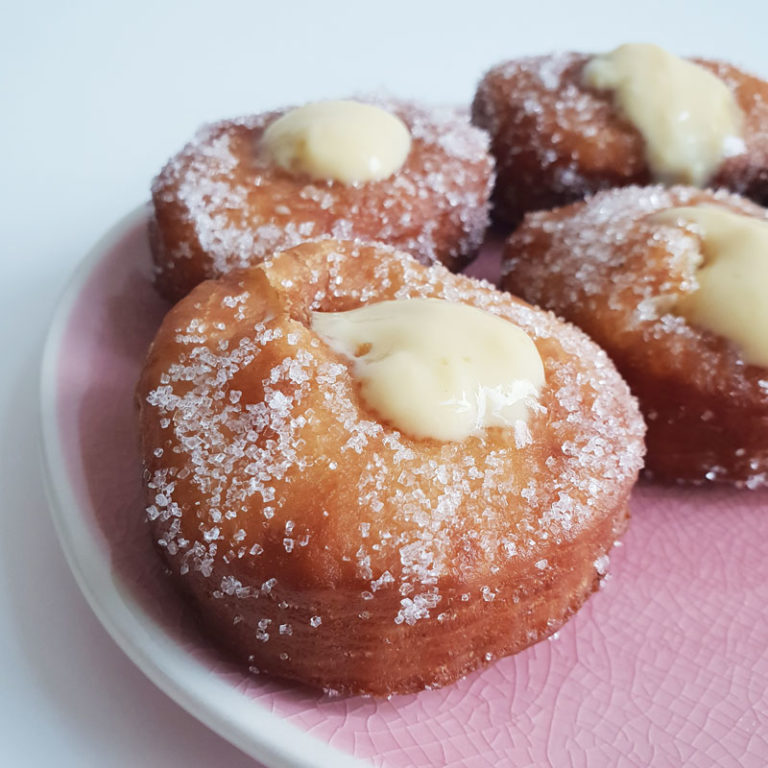
The image size is (768, 768). Find the location of `plate`. plate is located at coordinates (229, 714).